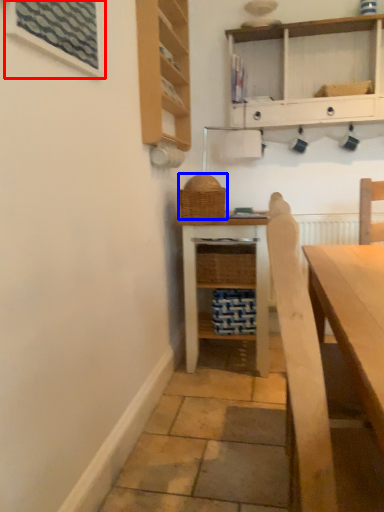
Question: Which point is closer to the camera, window (highlighted by a red box) or basket (highlighted by a blue box)?

Choices:
 (A) window
 (B) basket

Answer: (A)